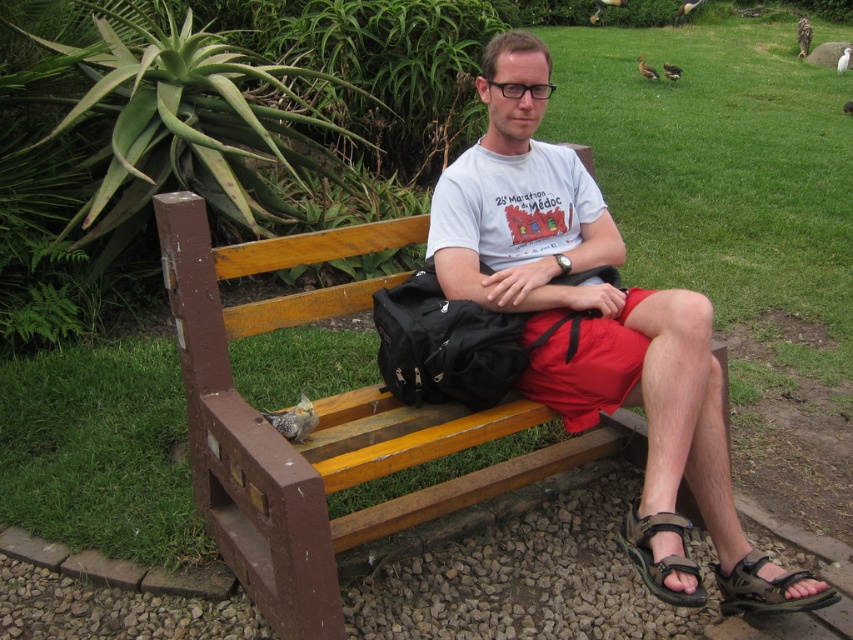
Question: Which object is closer to the camera taking this photo?

Choices:
 (A) brown leather sandal at lower center
 (B) wooden bench at center

Answer: (B)

Question: In this image, where is black fabric bag at center located relative to brown leather sandal at lower right?

Choices:
 (A) right
 (B) left

Answer: (B)

Question: Can you confirm if wooden bench at center is positioned below brown leather sandal at lower right?

Choices:
 (A) no
 (B) yes

Answer: (A)

Question: Estimate the real-world distances between objects in this image. Which object is closer to the black fabric bag at center?

Choices:
 (A) wooden bench at center
 (B) brown leather sandal at lower right
 (C) brown leather sandal at lower center
 (D) white cotton t-shirt at center

Answer: (D)

Question: Which of the following is the farthest from the observer?

Choices:
 (A) (376, 244)
 (B) (711, 500)

Answer: (A)

Question: Is red cotton shorts at center thinner than brown leather sandal at lower center?

Choices:
 (A) no
 (B) yes

Answer: (A)